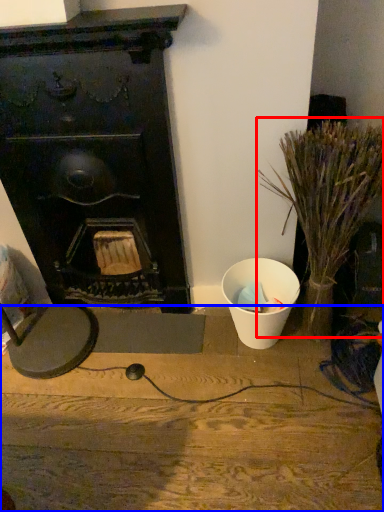
Question: Among these objects, which one is farthest to the camera, plant (highlighted by a red box) or furniture (highlighted by a blue box)?

Choices:
 (A) plant
 (B) furniture

Answer: (B)